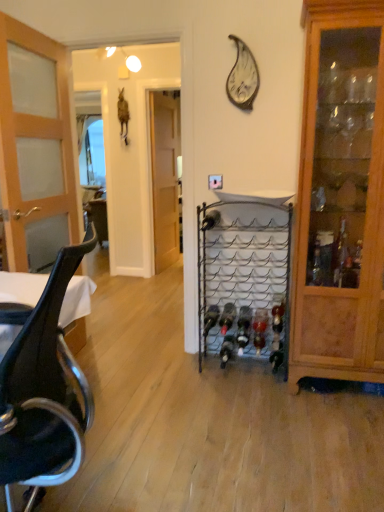
Where is `wooden door at center, arranged as the second door when viewed from the left`? Image resolution: width=384 pixels, height=512 pixels. wooden door at center, arranged as the second door when viewed from the left is located at coordinates (164, 179).

Locate an element on the screen. This screenshot has width=384, height=512. metallic silver wine bottle at center, the third wine bottle positioned from the left is located at coordinates (227, 317).

Find the location of a particular element. translucent glass wine bottle at center, arranged as the fourth wine bottle when viewed from the left is located at coordinates (243, 334).

Describe the element at coordinates (243, 334) in the screenshot. Image resolution: width=384 pixels, height=512 pixels. I see `translucent glass wine bottle at center, arranged as the fourth wine bottle when viewed from the left` at that location.

At what (x,y) coordinates should I click in order to perform the action: click on wooden cabinet at right. Please return your answer as a coordinate pair (x, y). Looking at the image, I should click on (340, 197).

Image resolution: width=384 pixels, height=512 pixels. In order to click on metallic wire wine rack at center in this screenshot , I will do `click(244, 270)`.

You are a GUI agent. You are given a task and a screenshot of the screen. Output one action in this format:
    pyautogui.click(x=<x>, y=<y>)
    Task: Click on the wooden door at center, the 2th door in the front-to-back sequence
    
    Given the screenshot: What is the action you would take?
    pyautogui.click(x=164, y=179)

Which is correct: metallic wire wine rack at center is inside translucent glass wine bottle at center, acting as the seventh wine bottle starting from the left, or outside of it?

metallic wire wine rack at center cannot be found inside translucent glass wine bottle at center, acting as the seventh wine bottle starting from the left.

Does metallic wire wine rack at center appear on the right side of translucent glass wine bottle at center, acting as the seventh wine bottle starting from the left?

In fact, metallic wire wine rack at center is to the left of translucent glass wine bottle at center, acting as the seventh wine bottle starting from the left.

From a real-world perspective, which is physically above, metallic wire wine rack at center or translucent glass wine bottle at center, acting as the seventh wine bottle starting from the left?

metallic wire wine rack at center, from a real-world perspective.

Does metallic wire wine rack at center turn towards translucent glass wine bottle at center, arranged as the first wine bottle when viewed from the right?

Yes, metallic wire wine rack at center is facing translucent glass wine bottle at center, arranged as the first wine bottle when viewed from the right.

Which is more to the left, light brown wooden door at left, the 1th door positioned from the front, or wooden cabinet at right?

light brown wooden door at left, the 1th door positioned from the front, is more to the left.

How different are the orientations of light brown wooden door at left, which is counted as the 2th door, starting from the back, and wooden cabinet at right in degrees?

The angle between the facing direction of light brown wooden door at left, which is counted as the 2th door, starting from the back, and the facing direction of wooden cabinet at right is 94.5 degrees.

In terms of width, does light brown wooden door at left, the 1th door positioned from the front, look wider or thinner when compared to wooden cabinet at right?

light brown wooden door at left, the 1th door positioned from the front, is thinner than wooden cabinet at right.

In terms of size, does light brown wooden door at left, which is counted as the 2th door, starting from the back, appear bigger or smaller than wooden cabinet at right?

In the image, light brown wooden door at left, which is counted as the 2th door, starting from the back, appears to be smaller than wooden cabinet at right.

Measure the distance between black leather chair at left and translucent glass wine bottle at center, which ranks as the 3th wine bottle in right-to-left order.

black leather chair at left and translucent glass wine bottle at center, which ranks as the 3th wine bottle in right-to-left order, are 1.31 meters apart from each other.

Which object is more forward, black leather chair at left or translucent glass wine bottle at center, the 5th wine bottle positioned from the left?

black leather chair at left is closer to the camera.

From their relative heights in the image, would you say black leather chair at left is taller or shorter than translucent glass wine bottle at center, which ranks as the 3th wine bottle in right-to-left order?

In the image, black leather chair at left appears to be taller than translucent glass wine bottle at center, which ranks as the 3th wine bottle in right-to-left order.

Is black leather chair at left positioned far away from translucent glass wine bottle at center, the 5th wine bottle positioned from the left?

Yes, black leather chair at left and translucent glass wine bottle at center, the 5th wine bottle positioned from the left, are quite far apart.

Looking at this image, considering the positions of objects black leather chair at left and black glass wine bottle at center, which appears as the 2th wine bottle when viewed from the left, in the image provided, who is behind, black leather chair at left or black glass wine bottle at center, which appears as the 2th wine bottle when viewed from the left,?

black glass wine bottle at center, which appears as the 2th wine bottle when viewed from the left, is more distant.

Looking at this image, does black leather chair at left turn towards black glass wine bottle at center, which is the sixth wine bottle in right-to-left order?

No, black leather chair at left is not facing towards black glass wine bottle at center, which is the sixth wine bottle in right-to-left order.

From the picture: Is black leather chair at left outside of black glass wine bottle at center, which appears as the 2th wine bottle when viewed from the left?

Yes, black leather chair at left is not within black glass wine bottle at center, which appears as the 2th wine bottle when viewed from the left.

Is point (60, 180) closer to camera compared to point (207, 319)?

No, it is behind (207, 319).

Is light brown wooden door at left, the 1th door positioned from the front, aimed at black glass wine bottle at center, which ranks as the 1th wine bottle in left-to-right order?

Yes.

Considering the sizes of light brown wooden door at left, the second door positioned from the right, and black glass wine bottle at center, marked as the seventh wine bottle in a right-to-left arrangement, in the image, is light brown wooden door at left, the second door positioned from the right, wider or thinner than black glass wine bottle at center, marked as the seventh wine bottle in a right-to-left arrangement,?

light brown wooden door at left, the second door positioned from the right, is thinner than black glass wine bottle at center, marked as the seventh wine bottle in a right-to-left arrangement.

From a real-world perspective, is light brown wooden door at left, the second door positioned from the right, physically below black glass wine bottle at center, marked as the seventh wine bottle in a right-to-left arrangement?

No.

From a real-world perspective, is translucent glass wine bottle at center, which ranks as the 3th wine bottle in right-to-left order, over metallic wire wine rack at center?

No, from a real-world perspective, translucent glass wine bottle at center, which ranks as the 3th wine bottle in right-to-left order, is not above metallic wire wine rack at center.

Locate an element on the screen. The image size is (384, 512). cage on the left of translucent glass wine bottle at center, the 5th wine bottle positioned from the left is located at coordinates (244, 270).

What's the angular difference between translucent glass wine bottle at center, which ranks as the 3th wine bottle in right-to-left order, and metallic wire wine rack at center's facing directions?

0.787 degrees separate the facing orientations of translucent glass wine bottle at center, which ranks as the 3th wine bottle in right-to-left order, and metallic wire wine rack at center.

From the image's perspective, is translucent glass wine bottle at center, which ranks as the 3th wine bottle in right-to-left order, positioned above or below metallic wire wine rack at center?

Clearly, from the image's perspective, translucent glass wine bottle at center, which ranks as the 3th wine bottle in right-to-left order, is below metallic wire wine rack at center.

From a real-world perspective, is wooden cabinet at right under black leather chair at left?

No, from a real-world perspective, wooden cabinet at right is not beneath black leather chair at left.

Is wooden cabinet at right positioned with its back to black leather chair at left?

No.

How different are the orientations of wooden cabinet at right and black leather chair at left in degrees?

The facing directions of wooden cabinet at right and black leather chair at left are 73.5 degrees apart.

From the image's perspective, does wooden cabinet at right appear lower than black leather chair at left?

Actually, wooden cabinet at right appears above black leather chair at left in the image.

Which wine bottle is the 1st one when counting from the back of the metallic wire wine rack at center? Please provide its 2D coordinates.

[(278, 312)]

At what (x,y) coordinates should I click in order to perform the action: click on the 2nd door counting from the left of the wooden cabinet at right. Please return your answer as a coordinate pair (x, y). Looking at the image, I should click on [36, 147].

Estimate the real-world distances between objects in this image. Which object is further from black glass wine bottle at center, which is the sixth wine bottle in right-to-left order, wooden door at center, which ranks as the 1th door in back-to-front order, or black leather chair at left?

wooden door at center, which ranks as the 1th door in back-to-front order, lies further to black glass wine bottle at center, which is the sixth wine bottle in right-to-left order, than the other object.

Looking at the image, which one is located closer to black glass wine bottle at center, which is the sixth wine bottle in right-to-left order, metallic wire wine rack at center or translucent glass wine bottle at center, the 5th wine bottle positioned from the left?

Based on the image, translucent glass wine bottle at center, the 5th wine bottle positioned from the left, appears to be nearer to black glass wine bottle at center, which is the sixth wine bottle in right-to-left order.

Considering their positions, is translucent glass wine bottle at center, arranged as the fourth wine bottle when viewed from the left, positioned closer to black glass wine bottle at center, which is the sixth wine bottle in right-to-left order, than wooden door at center, the 2th door in the front-to-back sequence?

Among the two, translucent glass wine bottle at center, arranged as the fourth wine bottle when viewed from the left, is located nearer to black glass wine bottle at center, which is the sixth wine bottle in right-to-left order.

When comparing their distances from translucent glass wine bottle at center, which ranks as the 3th wine bottle in right-to-left order, does translucent glass wine bottle at center, placed as the fourth wine bottle when sorted from right to left, or light brown wooden door at left, the 1th door positioned from the front, seem closer?

Based on the image, translucent glass wine bottle at center, placed as the fourth wine bottle when sorted from right to left, appears to be nearer to translucent glass wine bottle at center, which ranks as the 3th wine bottle in right-to-left order.

From the image, which object appears to be nearer to wooden cabinet at right, metallic silver wine bottle at center, the third wine bottle positioned from the left, or wooden door at center, the 2th door in the front-to-back sequence?

metallic silver wine bottle at center, the third wine bottle positioned from the left, lies closer to wooden cabinet at right than the other object.

Which object lies further to the anchor point translucent glass wine bottle at center, arranged as the second wine bottle when viewed from the right, wooden cabinet at right or translucent glass wine bottle at center, the 5th wine bottle positioned from the left?

wooden cabinet at right is further to translucent glass wine bottle at center, arranged as the second wine bottle when viewed from the right.

Which object lies further to the anchor point black glass wine bottle at center, which is the sixth wine bottle in right-to-left order, wooden cabinet at right or black glass wine bottle at center, marked as the seventh wine bottle in a right-to-left arrangement?

Among the two, wooden cabinet at right is located further to black glass wine bottle at center, which is the sixth wine bottle in right-to-left order.

Which object lies further to the anchor point translucent glass wine bottle at center, the 5th wine bottle positioned from the left, metallic silver wine bottle at center, the third wine bottle positioned from the left, or translucent glass wine bottle at center, acting as the 6th wine bottle starting from the left?

translucent glass wine bottle at center, acting as the 6th wine bottle starting from the left.

Where is `cage positioned between black leather chair at left and translucent glass wine bottle at center, arranged as the fourth wine bottle when viewed from the left, from near to far`? cage positioned between black leather chair at left and translucent glass wine bottle at center, arranged as the fourth wine bottle when viewed from the left, from near to far is located at coordinates (244, 270).

Image resolution: width=384 pixels, height=512 pixels. In order to click on wine bottle located between light brown wooden door at left, the 1th door positioned from the front, and black glass wine bottle at center, which appears as the 2th wine bottle when viewed from the left, in the left-right direction in this screenshot , I will do `click(210, 318)`.

Image resolution: width=384 pixels, height=512 pixels. I want to click on cabinetry between black leather chair at left and black glass wine bottle at center, which ranks as the 1th wine bottle in left-to-right order, along the z-axis, so click(340, 197).

Identify the location of cage between black leather chair at left and wooden door at center, arranged as the second door when viewed from the left, from front to back. (244, 270).